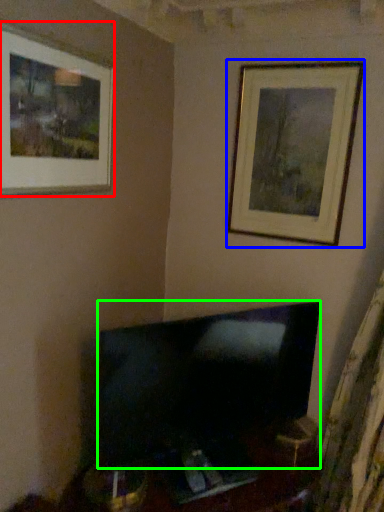
Question: Considering the real-world distances, which object is farthest from picture frame (highlighted by a red box)? picture frame (highlighted by a blue box) or television (highlighted by a green box)?

Choices:
 (A) picture frame
 (B) television

Answer: (B)